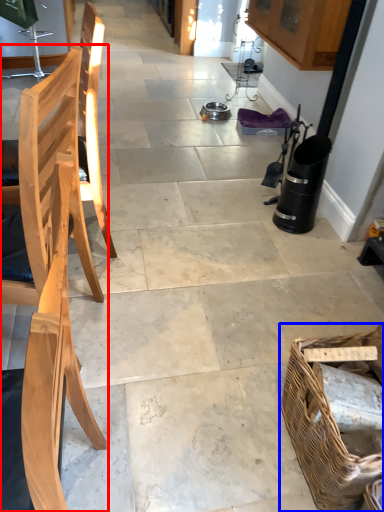
Question: Which object appears farthest to the camera in this image, chair (highlighted by a red box) or picnic basket (highlighted by a blue box)?

Choices:
 (A) chair
 (B) picnic basket

Answer: (B)